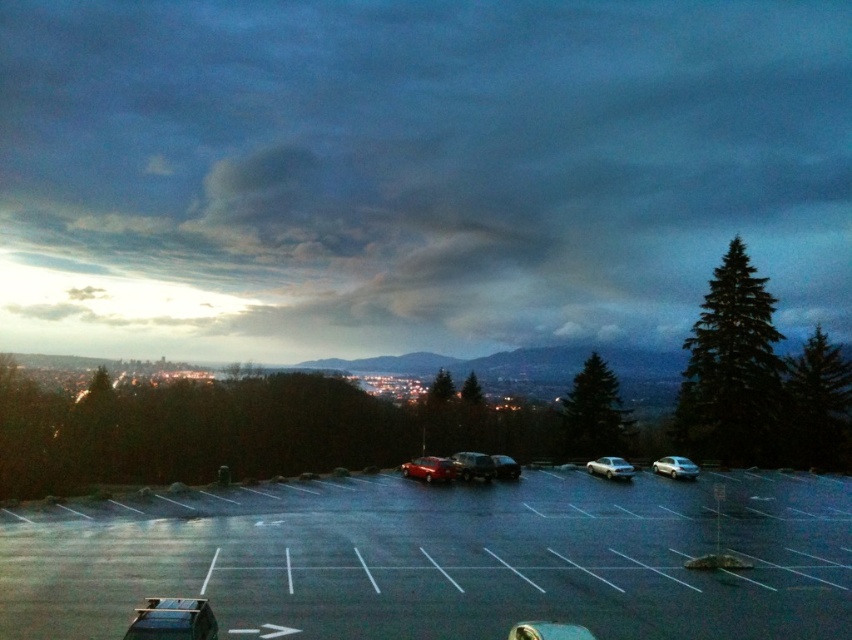
Can you confirm if shiny black sedan at center is positioned to the right of shiny silver sedan at center?

In fact, shiny black sedan at center is to the left of shiny silver sedan at center.

Which of these two, shiny black sedan at center or shiny silver sedan at center, stands taller?

shiny silver sedan at center is taller.

Is point (486, 476) positioned behind point (516, 476)?

No, (486, 476) is closer to viewer.

Where is `shiny black sedan at center`? shiny black sedan at center is located at coordinates (473, 467).

Which is below, metallic silver car at lower left or satin silver sedan at right?

satin silver sedan at right is below.

Who is positioned more to the right, metallic silver car at lower left or satin silver sedan at right?

From the viewer's perspective, satin silver sedan at right appears more on the right side.

Is point (160, 612) behind point (686, 464)?

No, (160, 612) is closer to viewer.

The image size is (852, 640). What are the coordinates of `metallic silver car at lower left` in the screenshot? It's located at (173, 620).

In the scene shown: Who is shorter, satin silver sedan at center or satin silver sedan at right?

satin silver sedan at right

Between point (597, 461) and point (666, 467), which one is positioned behind?

Point (597, 461)

What do you see at coordinates (611, 467) in the screenshot? The width and height of the screenshot is (852, 640). I see `satin silver sedan at center` at bounding box center [611, 467].

The width and height of the screenshot is (852, 640). In order to click on satin silver sedan at center in this screenshot , I will do `click(611, 467)`.